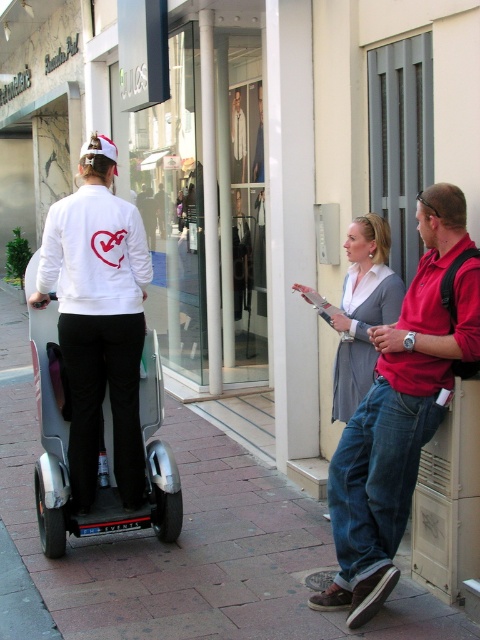
You are a delivery driver who needs to pass by the silver metallic scooter at left and the red shirt at right. Which object should you move first to create a clear path?

You should move the red shirt at right first because it is in front of the silver metallic scooter at left, so moving the red shirt at right first would allow you to create a clear path.

You are a delivery person standing on the brick pavement at center. You need to deliver a package to the red shirt at right. Which direction should you move to reach them?

The brick pavement at center is positioned under red shirt at right, so you should move forward towards the red shirt at right since they are standing on the same pavement.